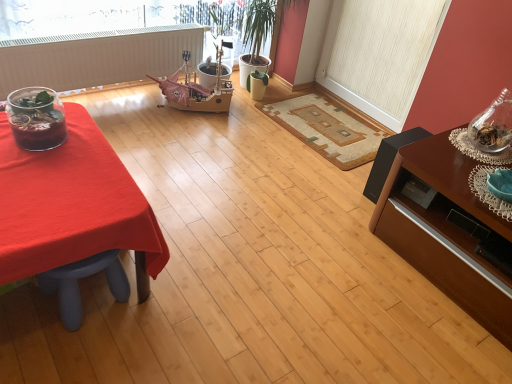
Locate an element on the screen. The width and height of the screenshot is (512, 384). vacant space to the right of smooth red tablecloth at left is located at coordinates (211, 288).